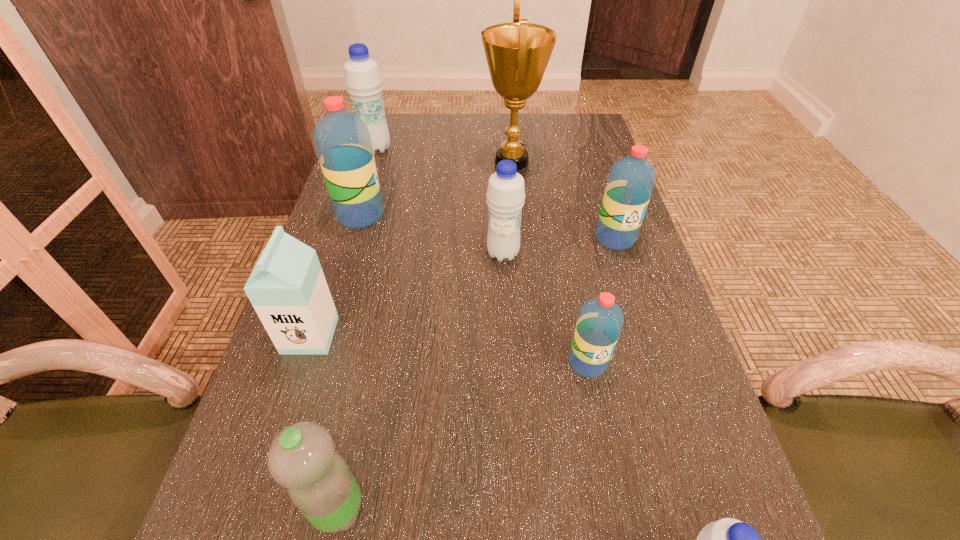
Locate an element on the screen. gold award is located at coordinates (517, 53).

Find the location of a particular element. The height and width of the screenshot is (540, 960). award is located at coordinates (517, 53).

At what (x,y) coordinates should I click in order to perform the action: click on the farthest water bottle. Please return your answer as a coordinate pair (x, y). Looking at the image, I should click on (363, 80).

Where is `the farthest blue water bottle`? the farthest blue water bottle is located at coordinates (363, 80).

You are a GUI agent. You are given a task and a screenshot of the screen. Output one action in this format:
    pyautogui.click(x=<x>, y=<y>)
    Task: Click on the leftmost red water bottle
    Image resolution: width=960 pixels, height=540 pixels.
    Given the screenshot: What is the action you would take?
    pyautogui.click(x=342, y=140)

Where is `the second biggest red water bottle`? The height and width of the screenshot is (540, 960). the second biggest red water bottle is located at coordinates (631, 179).

At what (x,y) coordinates should I click in order to perform the action: click on the second blue water bottle from right to left. Please return your answer as a coordinate pair (x, y). Looking at the image, I should click on (505, 194).

You are a GUI agent. You are given a task and a screenshot of the screen. Output one action in this format:
    pyautogui.click(x=<x>, y=<y>)
    Task: Click on the second biggest blue water bottle
    
    Given the screenshot: What is the action you would take?
    pyautogui.click(x=505, y=194)

What are the coordinates of `the eighth farthest object` in the screenshot? It's located at (302, 458).

You are a GUI agent. You are given a task and a screenshot of the screen. Output one action in this format:
    pyautogui.click(x=<x>, y=<y>)
    Task: Click on the sixth farthest water bottle
    This screenshot has width=960, height=540.
    Given the screenshot: What is the action you would take?
    pyautogui.click(x=302, y=458)